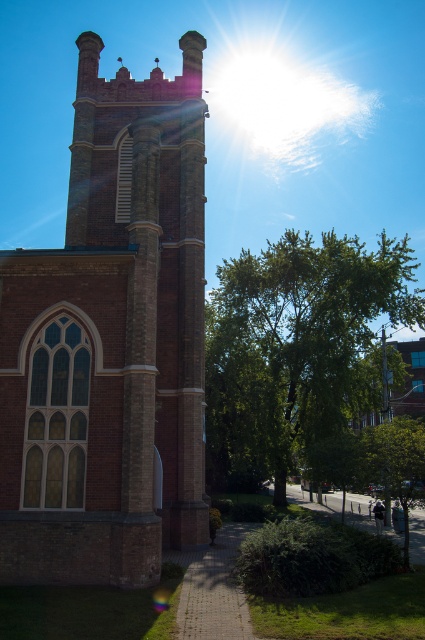
You are a photographer wanting to capture both the brick tower at left and the green leafy tree at center in a single frame. Based on their widths, which object would appear narrower in the photo?

The brick tower at left has a lesser width compared to the green leafy tree at center, so it would appear narrower in the photo.

You are standing in front of the historic brick church and want to locate the point at coordinates point [110,342]. Based on the scene description, where exactly on the brick tower at left would this point be located?

The point [110,342] is located on the brick tower at left, specifically at the position where the vertical ventilation shaft is visible on one side of the tower.

You are standing in front of the historic brick church and want to take a photo of the green leafy tree at center without the brick tower at left blocking it. Which direction should you move to ensure the tree is fully visible?

The brick tower at left is in front of the green leafy tree at center, so you should move to the right side of the scene to position yourself where the tree is no longer obscured by the tower.